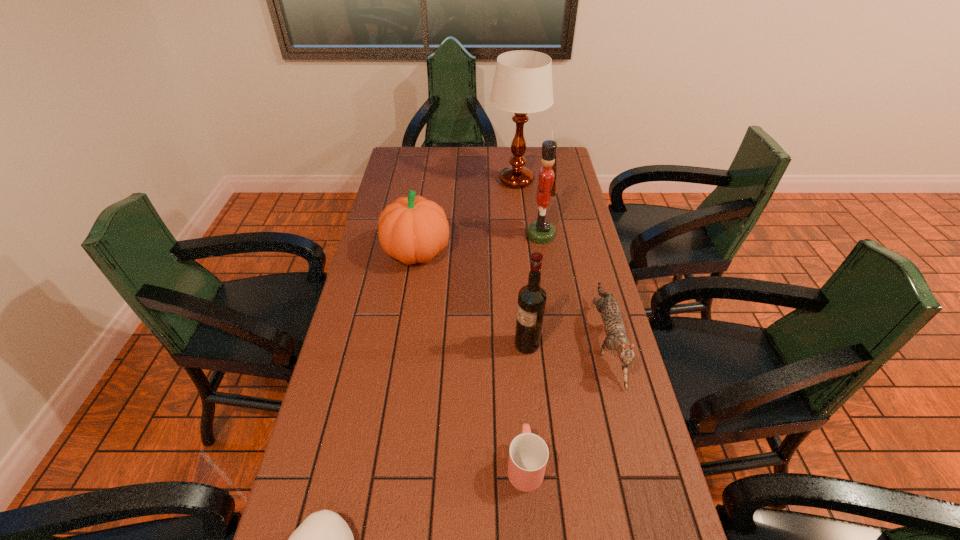
You are a GUI agent. You are given a task and a screenshot of the screen. Output one action in this format:
    pyautogui.click(x=<x>, y=<y>)
    Task: Click on the vacant space situated 0.230m on the front-facing side of the nutcracker
    
    Given the screenshot: What is the action you would take?
    pyautogui.click(x=464, y=235)

The height and width of the screenshot is (540, 960). In order to click on free space located on the front-facing side of the nutcracker in this screenshot , I will do `click(471, 235)`.

In order to click on free space located 0.320m on the front and back of the third tallest object in this screenshot , I will do `click(400, 345)`.

Identify the location of free space located 0.110m on the front and back of the third tallest object. This screenshot has width=960, height=540. [x=475, y=345].

The image size is (960, 540). I want to click on vacant region located 0.130m on the front and back of the third tallest object, so click(x=468, y=345).

Identify the location of vacant space located on the back of the pumpkin. (425, 196).

The height and width of the screenshot is (540, 960). I want to click on free space located 0.090m on the face of the fifth tallest object, so click(627, 426).

Find the location of a particular element. The image size is (960, 540). vacant space located 0.290m on the side of the cup with the handle is located at coordinates (516, 341).

The height and width of the screenshot is (540, 960). In order to click on free spot located 0.290m on the side of the cup with the handle in this screenshot , I will do click(x=516, y=341).

I want to click on free space located 0.310m on the side of the cup with the handle, so click(516, 336).